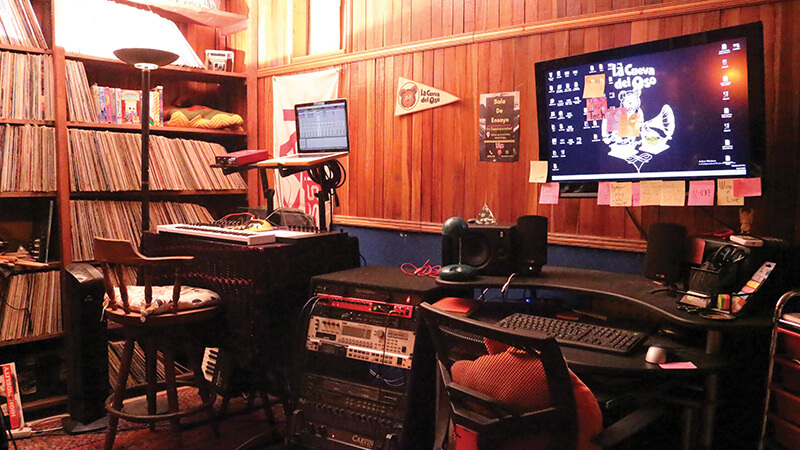
Locate an element on the screen. Image resolution: width=800 pixels, height=450 pixels. chair is located at coordinates (562, 383).